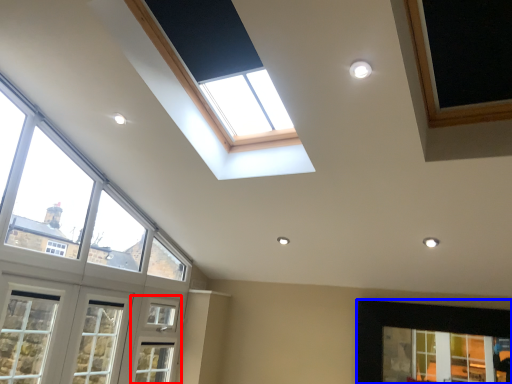
Question: Which point is further to the camera, screen door (highlighted by a red box) or window (highlighted by a blue box)?

Choices:
 (A) screen door
 (B) window

Answer: (A)